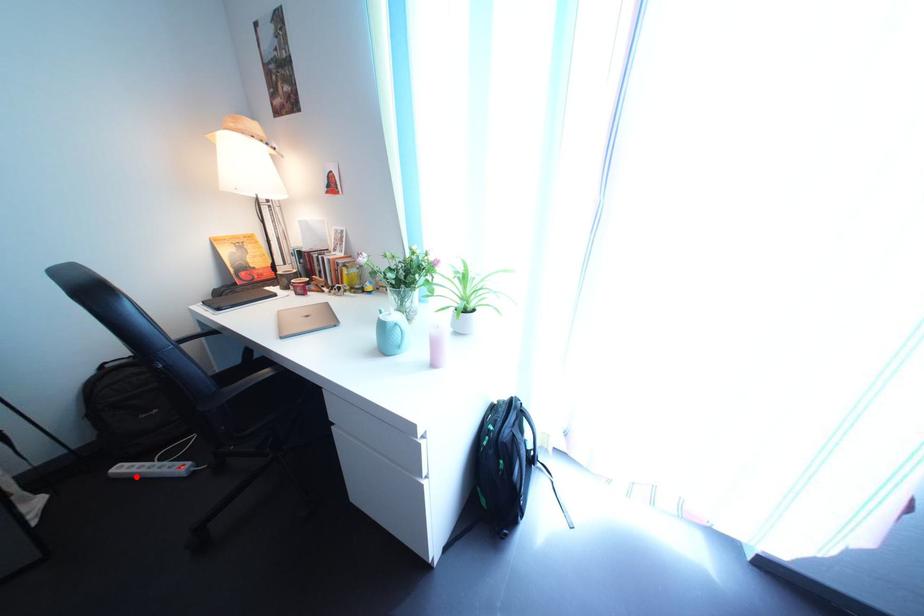
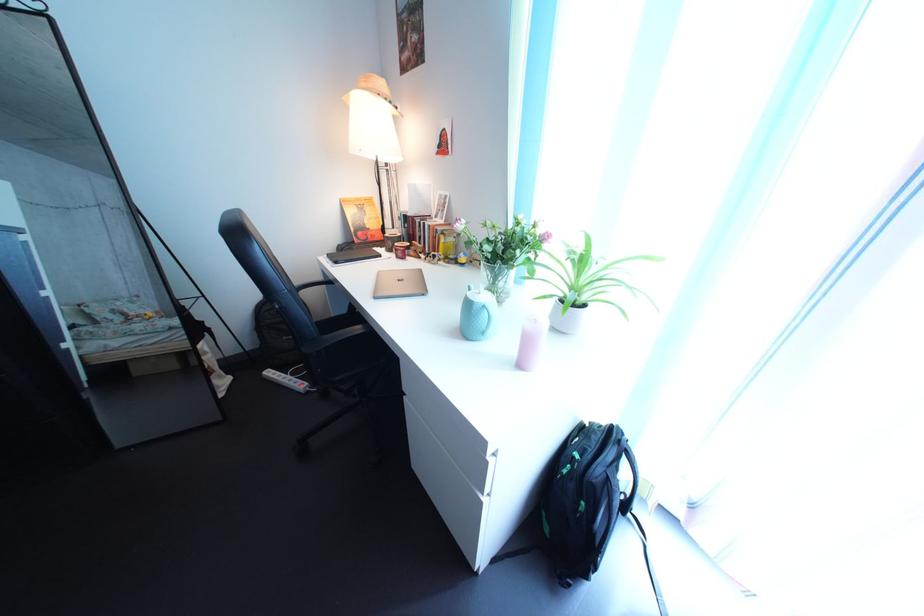
In the second image, find the point that corresponds to the highlighted location in the first image.

(284, 381)